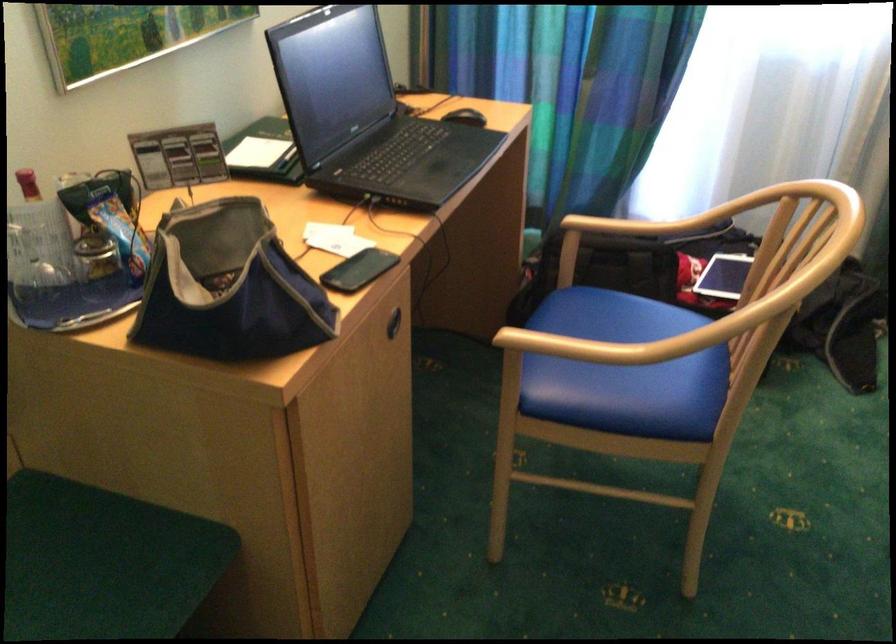
Image resolution: width=896 pixels, height=644 pixels. What are the coordinates of `glass water carafe` in the screenshot? It's located at (39, 249).